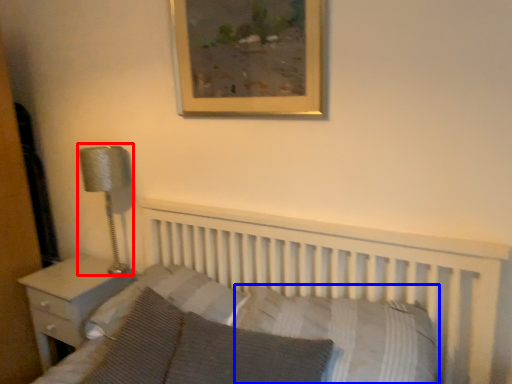
Question: Which point is further to the camera, lamp (highlighted by a red box) or pillow (highlighted by a blue box)?

Choices:
 (A) lamp
 (B) pillow

Answer: (A)